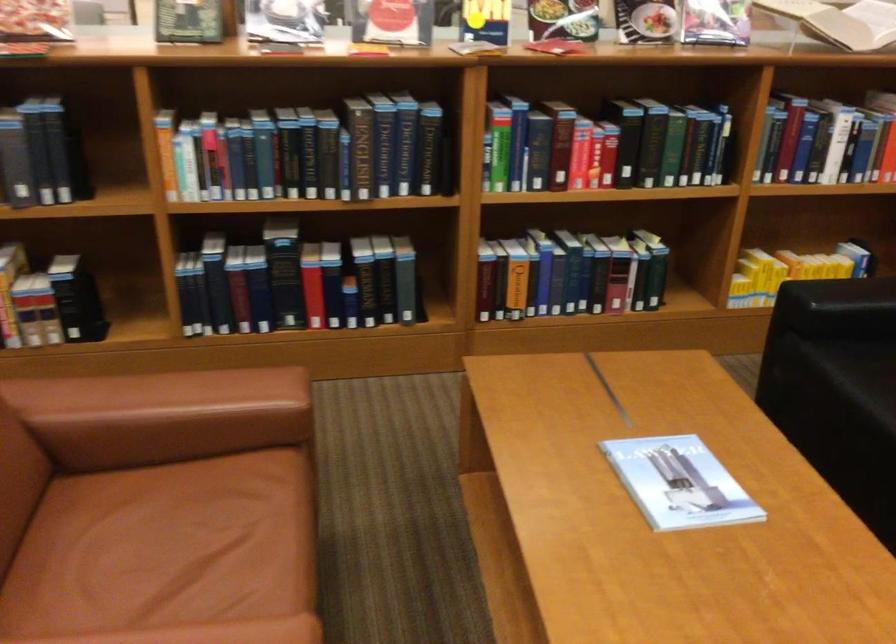
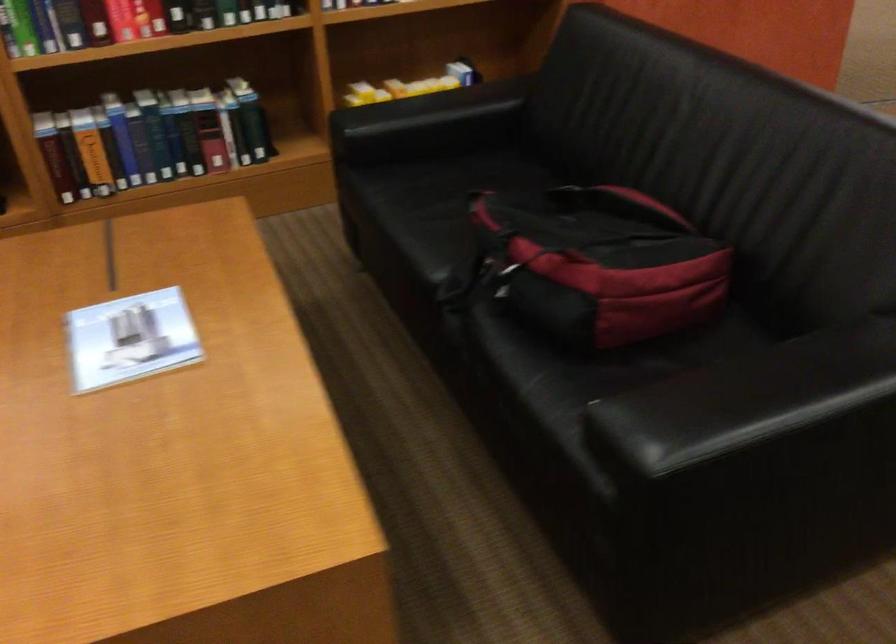
In the second image, find the point that corresponds to pixel 805 256 in the first image.

(410, 86)